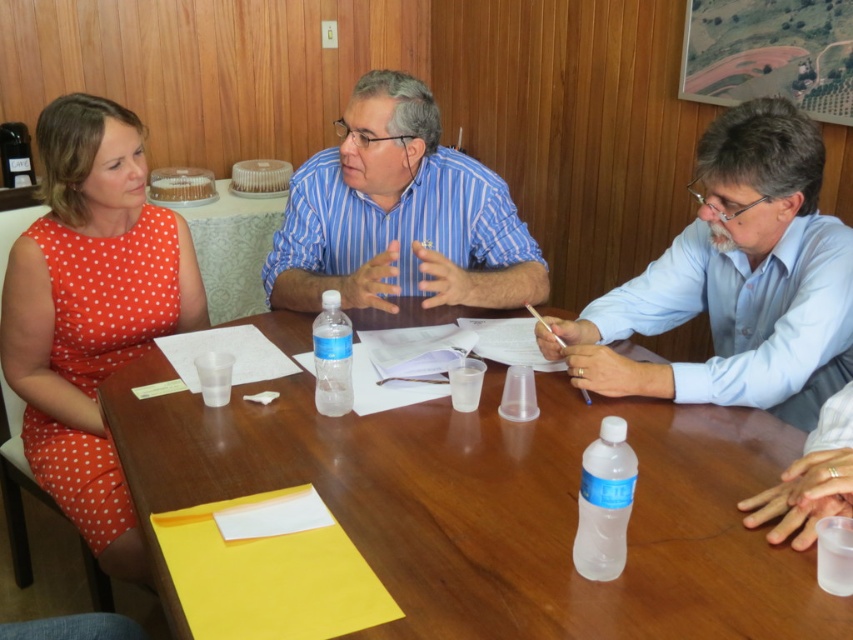
Question: Can you confirm if orange polka dot dress at left is bigger than blue striped shirt at center?

Choices:
 (A) no
 (B) yes

Answer: (B)

Question: Which of the following is the farthest from the observer?

Choices:
 (A) orange polka dot dress at left
 (B) blue smooth shirt at right
 (C) blue striped shirt at center

Answer: (C)

Question: Which point is farther to the camera?

Choices:
 (A) clear plastic water bottle at center
 (B) blue smooth shirt at right
 (C) wooden table at center

Answer: (B)

Question: Which object is closer to the camera taking this photo?

Choices:
 (A) clear plastic water bottle at center
 (B) blue smooth shirt at right
 (C) clear plastic bottle at center

Answer: (C)

Question: Does blue smooth shirt at right have a greater width compared to clear plastic bottle at center?

Choices:
 (A) no
 (B) yes

Answer: (B)

Question: Can you confirm if blue smooth shirt at right is smaller than clear plastic water bottle at center?

Choices:
 (A) no
 (B) yes

Answer: (A)